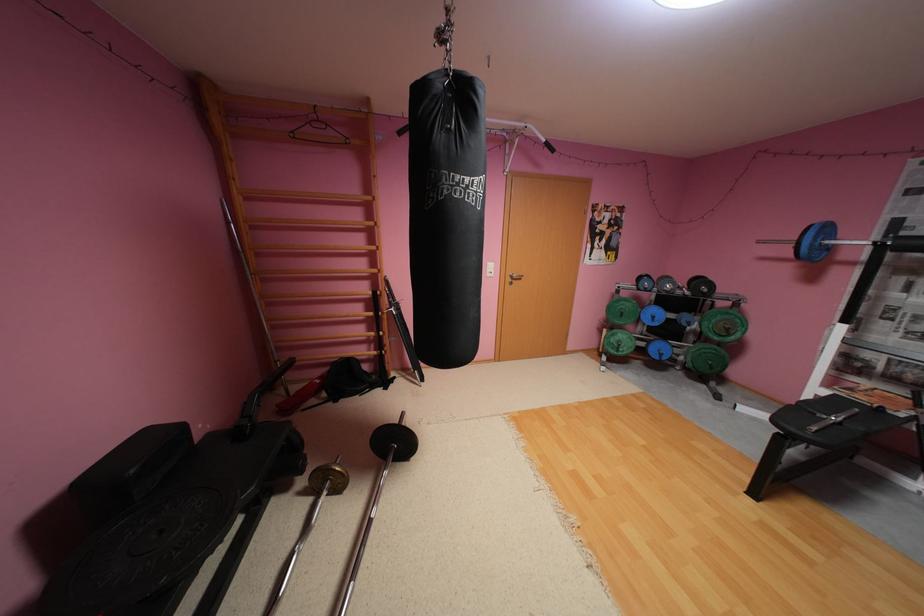
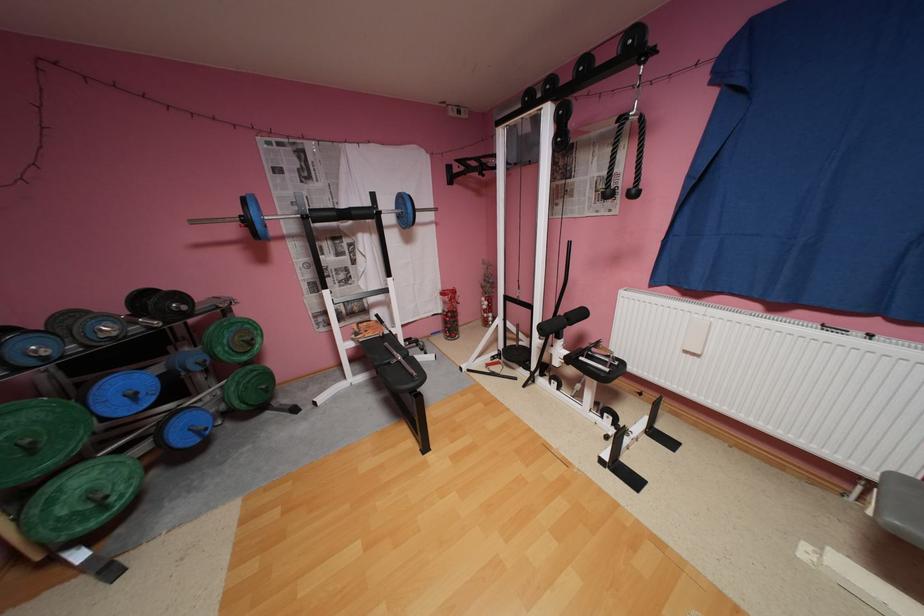
Locate, in the second image, the point that corresponds to point (662, 317) in the first image.

(142, 395)